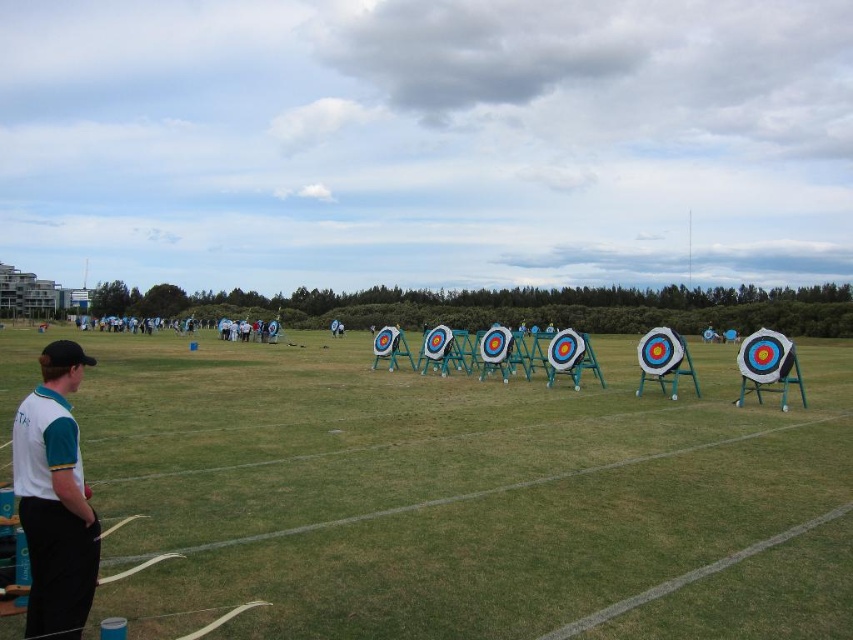
Based on the photo, you are an archer preparing to shoot an arrow. You notice the white paper targets at center and the white fabric shirt at lower left. Which object is wider in the image?

The white paper targets at center might be wider than white fabric shirt at lower left.

You are an archer preparing to shoot an arrow. You see the white paper targets at center and the white fabric shirt at lower left. Which object is positioned lower in the image?

The white paper targets at center is located below the white fabric shirt at lower left, so the white paper targets at center is positioned lower in the image.

In the scene shown: You are an archer preparing to shoot an arrow. You notice the white paper targets at center and the white fabric shirt at lower left. Which object is larger in size?

The white paper targets at center is bigger than the white fabric shirt at lower left.